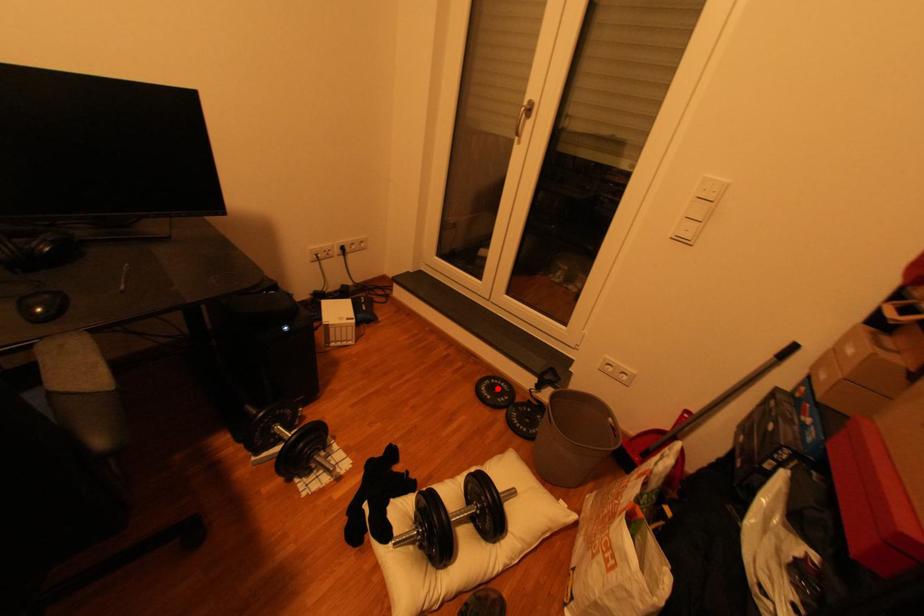
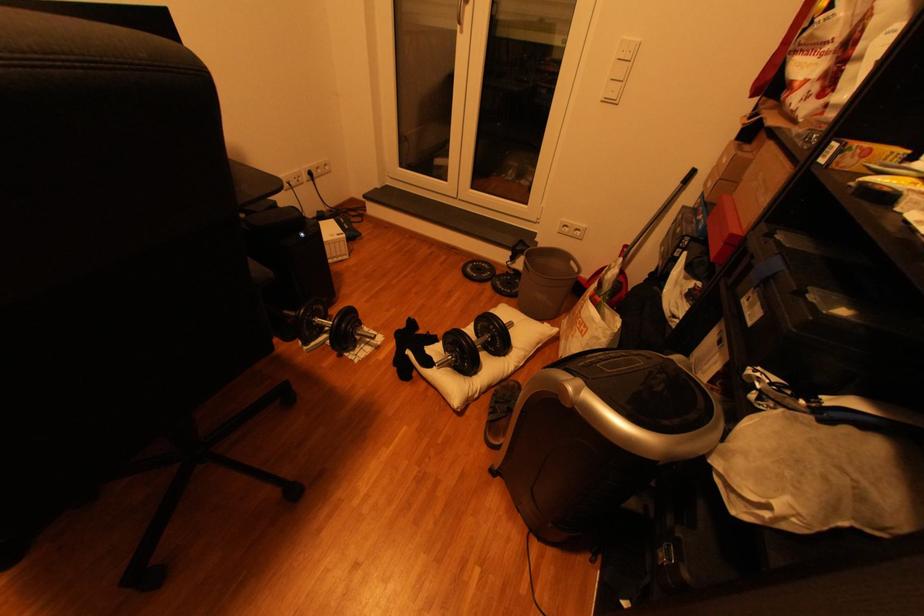
In the second image, find the point that corresponds to the highlighted location in the first image.

(482, 270)